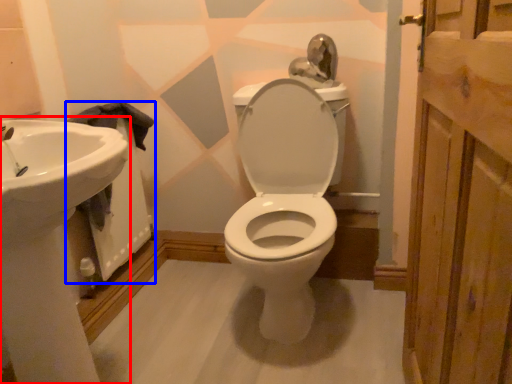
Question: Among these objects, which one is farthest to the camera, sink (highlighted by a red box) or bath (highlighted by a blue box)?

Choices:
 (A) sink
 (B) bath

Answer: (B)